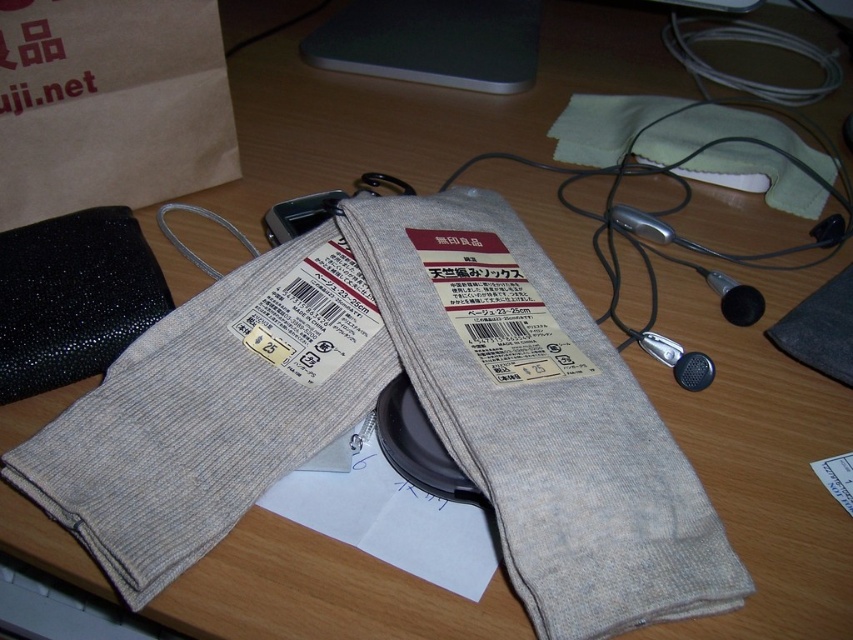
Question: Among these points, which one is nearest to the camera?

Choices:
 (A) (532, 496)
 (B) (282, 278)
 (C) (73, 10)

Answer: (A)

Question: Can you confirm if gray knitted socks at center is smaller than brown paper bag at upper left?

Choices:
 (A) no
 (B) yes

Answer: (A)

Question: Which object is the closest to the gray knitted socks at center?

Choices:
 (A) brown paper bag at upper left
 (B) gray ribbed socks at center

Answer: (B)

Question: Which point is farther to the camera?

Choices:
 (A) brown paper bag at upper left
 (B) gray knitted socks at center
 (C) gray ribbed socks at center

Answer: (A)

Question: Is gray knitted socks at center to the left of brown paper bag at upper left from the viewer's perspective?

Choices:
 (A) no
 (B) yes

Answer: (A)

Question: Does gray knitted socks at center have a lesser width compared to brown paper bag at upper left?

Choices:
 (A) yes
 (B) no

Answer: (B)